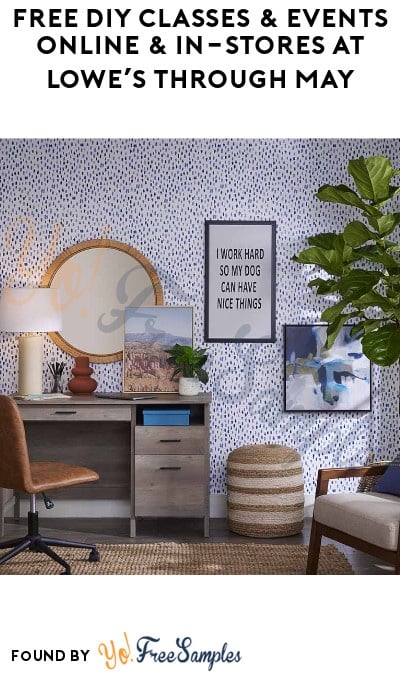
Locate an element on the screen. carpet is located at coordinates (147, 561).